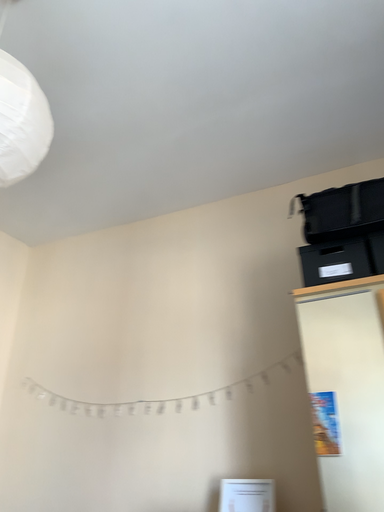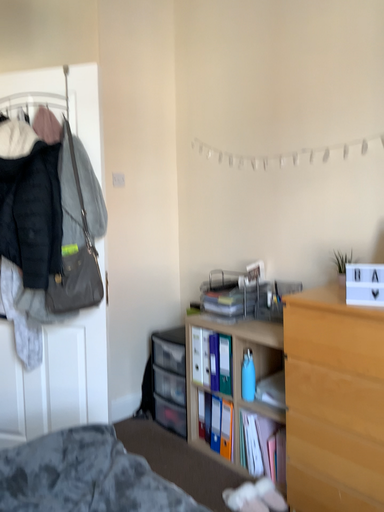
Question: How did the camera likely rotate when shooting the video?

Choices:
 (A) rotated left
 (B) rotated right

Answer: (A)